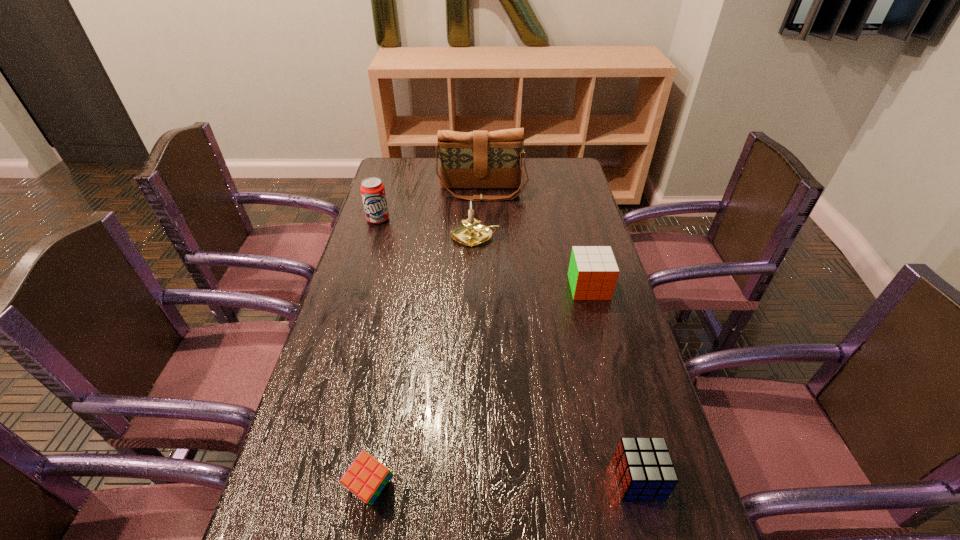
Where is `the tallest object`? This screenshot has width=960, height=540. the tallest object is located at coordinates (479, 159).

Locate an element on the screen. The image size is (960, 540). shoulder bag is located at coordinates (479, 159).

The height and width of the screenshot is (540, 960). Find the location of `the leftmost object`. the leftmost object is located at coordinates (372, 189).

Locate an element on the screen. the fifth nearest object is located at coordinates (372, 189).

At what (x,y) coordinates should I click in order to perform the action: click on the third farthest object. Please return your answer as a coordinate pair (x, y). The image size is (960, 540). Looking at the image, I should click on (470, 233).

Where is `the tallest cube`? The width and height of the screenshot is (960, 540). the tallest cube is located at coordinates (593, 272).

Where is `the third nearest object`? The image size is (960, 540). the third nearest object is located at coordinates pyautogui.click(x=593, y=272).

Locate an element on the screen. the fifth object from right to left is located at coordinates (366, 477).

This screenshot has width=960, height=540. What are the coordinates of `free space located 0.270m on the front-facing side of the tallest object` in the screenshot? It's located at (483, 246).

Find the location of a particular element. free space located 0.400m on the surface of the leftmost object is located at coordinates (351, 307).